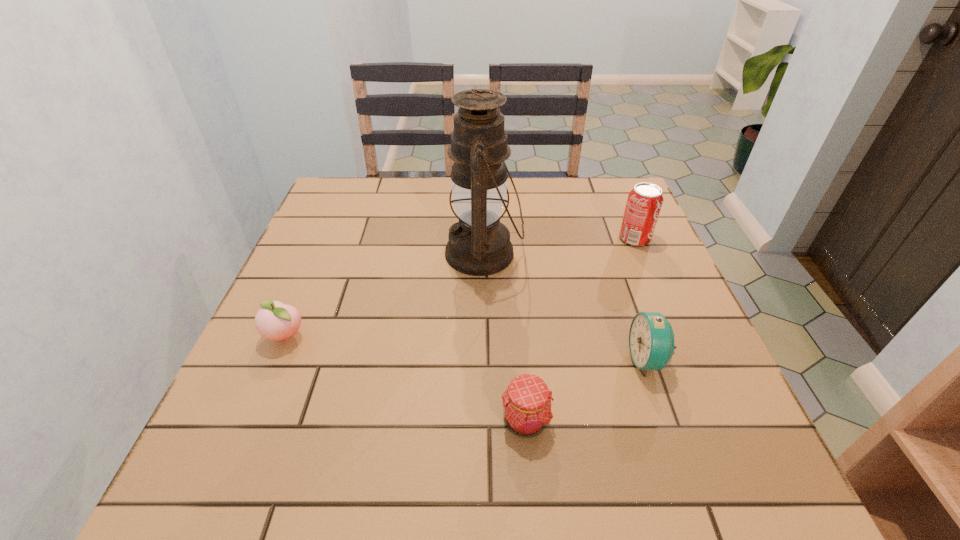
Identify the location of the tallest object. (479, 244).

In order to click on the fourth shortest object in this screenshot , I will do `click(645, 200)`.

Image resolution: width=960 pixels, height=540 pixels. What are the coordinates of `the rightmost object` in the screenshot? It's located at (645, 200).

You are a GUI agent. You are given a task and a screenshot of the screen. Output one action in this format:
    pyautogui.click(x=<x>, y=<y>)
    Task: Click on the alarm clock
    The height and width of the screenshot is (540, 960).
    Given the screenshot: What is the action you would take?
    pyautogui.click(x=651, y=339)

This screenshot has height=540, width=960. I want to click on the third tallest object, so click(x=651, y=339).

Where is `the leftmost object`? This screenshot has height=540, width=960. the leftmost object is located at coordinates (276, 321).

Locate an element on the screen. the nearest object is located at coordinates (527, 401).

You are a GUI agent. You are given a task and a screenshot of the screen. Output one action in this format:
    pyautogui.click(x=<x>, y=<y>)
    Task: Click on the vacant space positioned 0.230m on the front of the tallest object
    The height and width of the screenshot is (540, 960).
    Given the screenshot: What is the action you would take?
    pyautogui.click(x=485, y=371)

Locate an element on the screen. The image size is (960, 540). vacant space located 0.390m on the front of the fourth shortest object is located at coordinates (692, 374).

In order to click on vacant space located on the front-facing side of the third tallest object in this screenshot , I will do `click(569, 360)`.